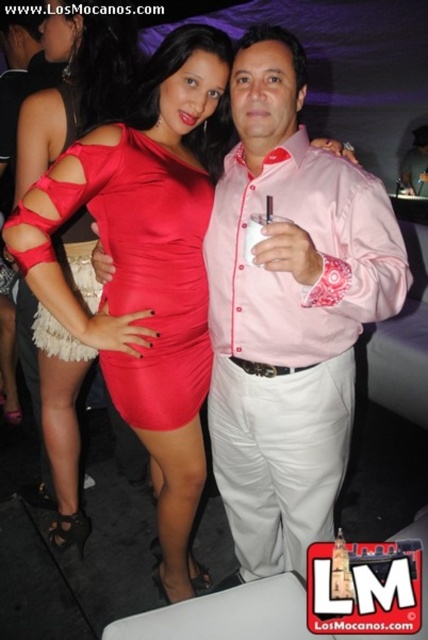
Question: Can you confirm if satin dress at center is wider than matte red dress at center?

Choices:
 (A) yes
 (B) no

Answer: (A)

Question: Can you confirm if satin dress at center is positioned above matte red dress at center?

Choices:
 (A) no
 (B) yes

Answer: (A)

Question: Where is pink satin shirt at center located in relation to matte red dress at center in the image?

Choices:
 (A) above
 (B) below

Answer: (B)

Question: Which point appears farthest from the camera in this image?

Choices:
 (A) (262, 230)
 (B) (342, 376)

Answer: (B)

Question: Which of the following is the closest to the observer?

Choices:
 (A) (249, 333)
 (B) (32, 172)
 (C) (45, 342)

Answer: (A)

Question: Based on their relative distances, which object is farther from the matte red dress at center?

Choices:
 (A) satin red dress at center
 (B) satin dress at center
 (C) clear plastic cup at center
 (D) pink satin shirt at center

Answer: (C)